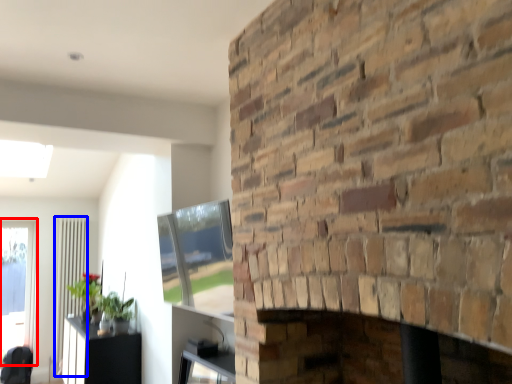
Question: Which of the following is the farthest to the observer, window (highlighted by a red box) or screen door (highlighted by a blue box)?

Choices:
 (A) window
 (B) screen door

Answer: (B)